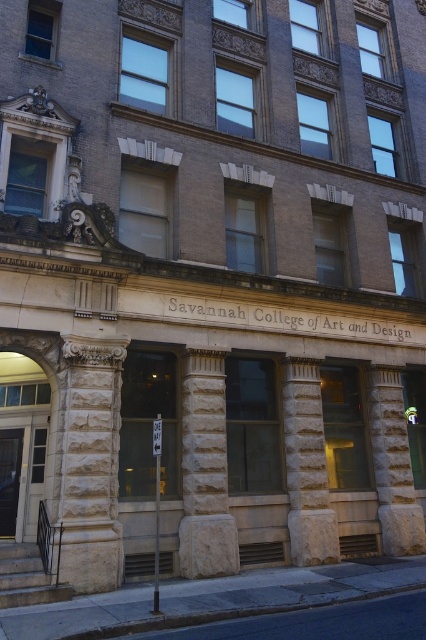
Question: Is the position of stone textured column at left more distant than that of gray stone column at center?

Choices:
 (A) no
 (B) yes

Answer: (A)

Question: Among these points, which one is farthest from the camera?

Choices:
 (A) (81, 384)
 (B) (397, 522)

Answer: (B)

Question: Which point is farther to the camera?

Choices:
 (A) stone textured column at left
 (B) white stone column at center
 (C) light beige stone column at center

Answer: (C)

Question: Does light beige stone column at center have a greater width compared to gray stone column at center?

Choices:
 (A) yes
 (B) no

Answer: (A)

Question: In this image, where is white stone column at center located relative to light beige stone column at center?

Choices:
 (A) below
 (B) above

Answer: (B)

Question: Which point is farther to the camera?

Choices:
 (A) (x=94, y=554)
 (B) (x=192, y=385)
 (C) (x=386, y=528)
 (D) (x=290, y=525)

Answer: (C)